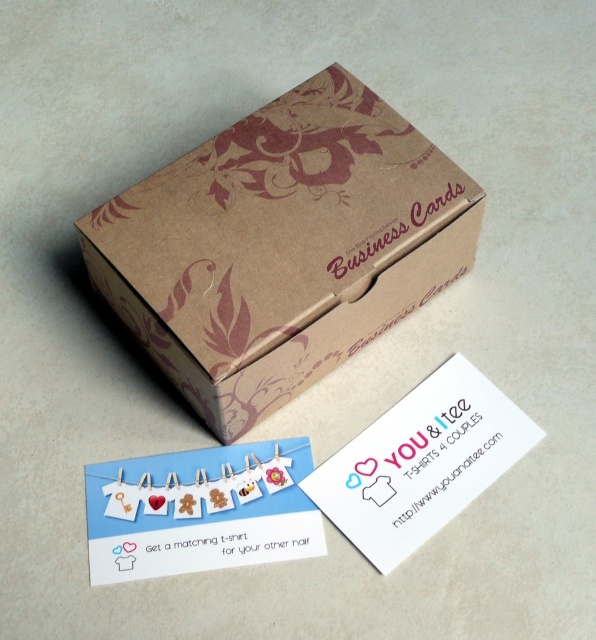
You are organizing a craft fair and need to place items on a table. You have a brown kraft paper business cards at center and a cardboard paper card at center. According to the image, which item is positioned higher up on the table?

The brown kraft paper business cards at center is above the cardboard paper card at center, so it is positioned higher up on the table.

You are organizing a craft fair and have two business cards to display. The brown kraft paper business cards at center and the cardboard paper card at center are both placed on a table. Which card should you choose if you want to display a wider card?

The brown kraft paper business cards at center should be chosen because its width surpasses the cardboard paper card at center.